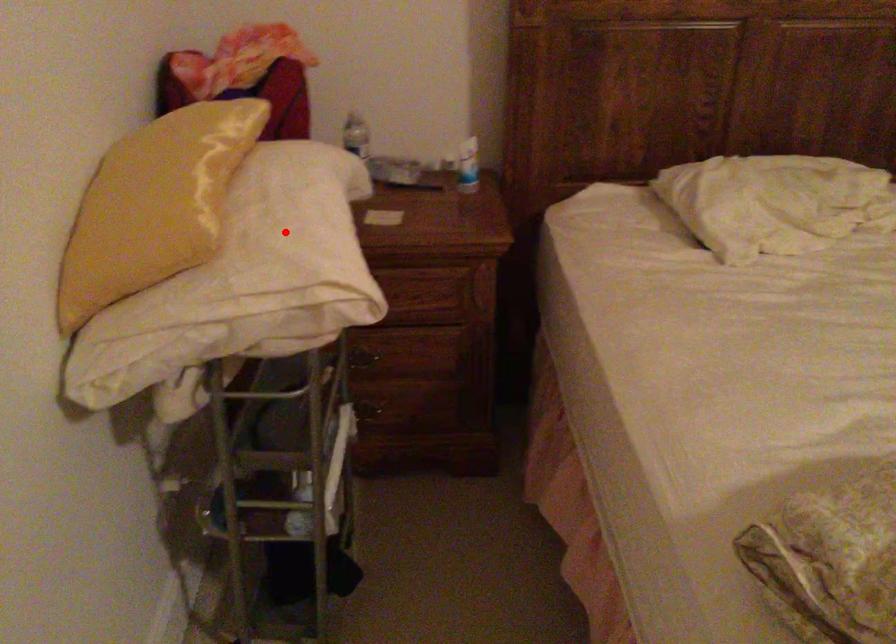
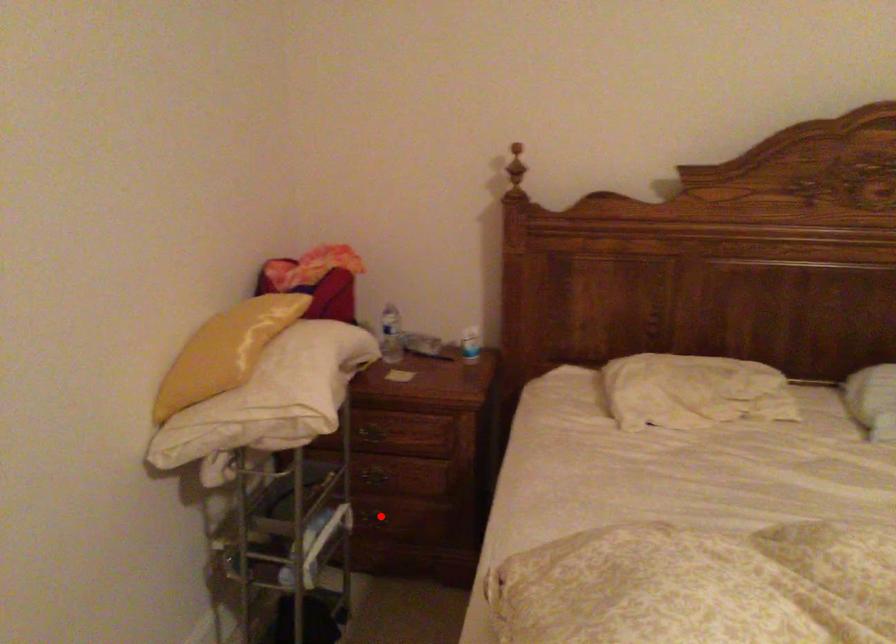
From the picture: I am providing you with two images of the same scene from different viewpoints. A red point is marked on the first image and another point is marked on the second image. Is the marked point in image1 the same physical position as the marked point in image2?

No